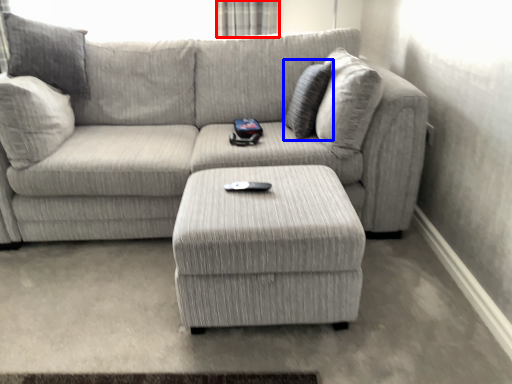
Question: Which point is further to the camera, curtain (highlighted by a red box) or pillow (highlighted by a blue box)?

Choices:
 (A) curtain
 (B) pillow

Answer: (A)